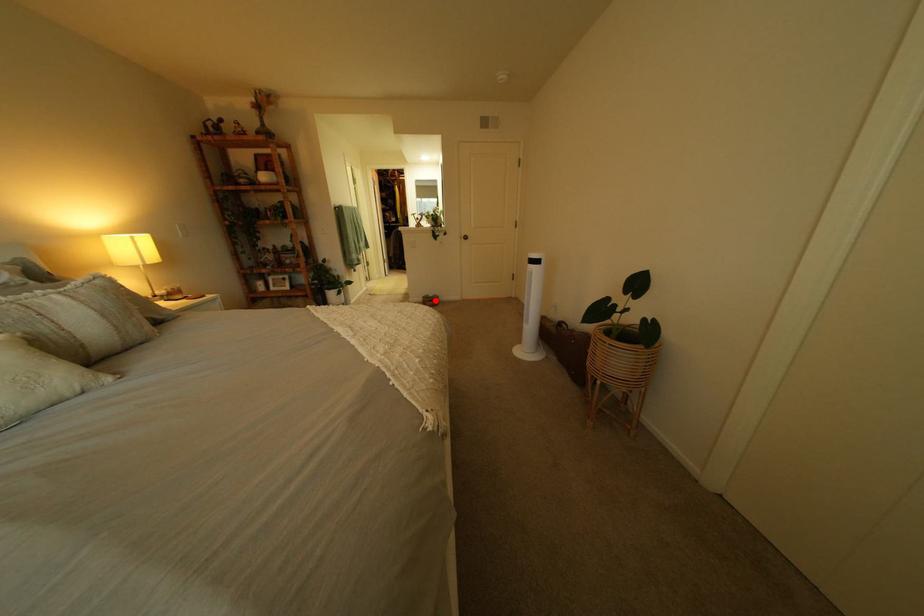
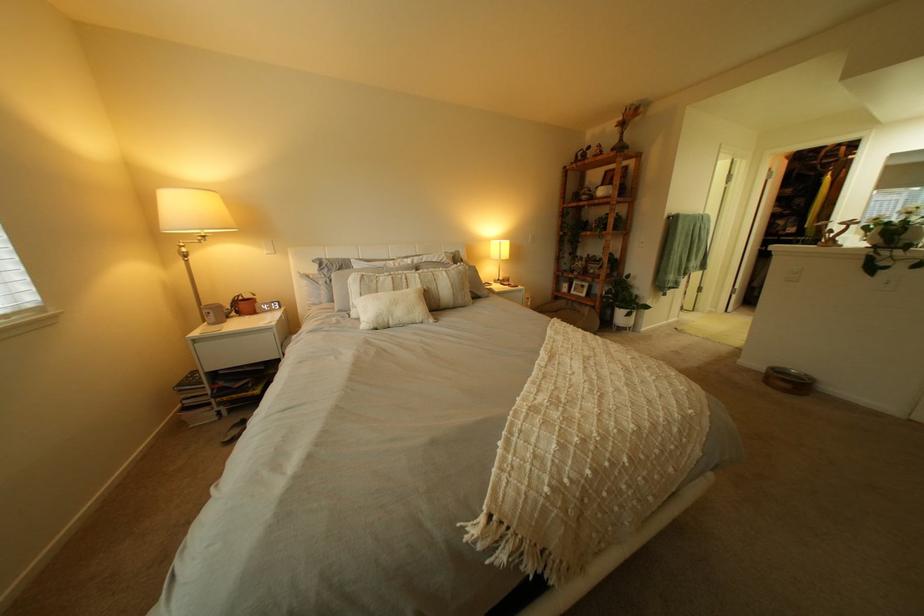
Question: I am providing you with two images of the same scene from different viewpoints. In image1, a red point is highlighted. Considering the same 3D point in image2, which of the following is correct?

Choices:
 (A) It is closer
 (B) It is farther

Answer: (B)